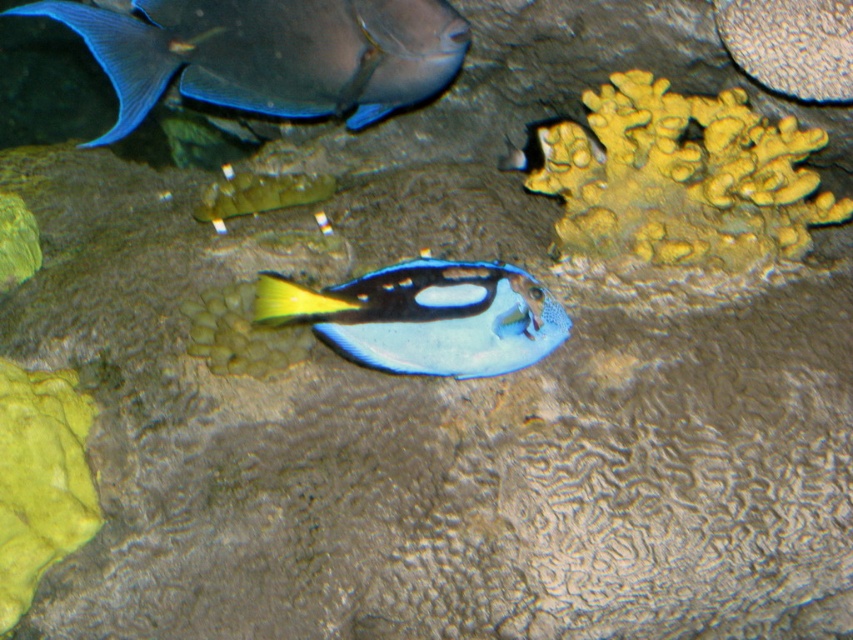
Which is more to the left, yellow porous coral at upper right or blue glossy fish at center?

From the viewer's perspective, blue glossy fish at center appears more on the left side.

Between point (785, 193) and point (482, 368), which one is positioned behind?

The point (785, 193) is more distant.

Measure the distance between yellow porous coral at upper right and camera.

yellow porous coral at upper right and camera are 5.98 feet apart from each other.

The height and width of the screenshot is (640, 853). In order to click on yellow porous coral at upper right in this screenshot , I will do `click(682, 179)`.

Looking at this image, is shiny blue fish at upper left to the left of blue glossy fish at center from the viewer's perspective?

Yes, shiny blue fish at upper left is to the left of blue glossy fish at center.

Is shiny blue fish at upper left further to the viewer compared to blue glossy fish at center?

Yes, it is behind blue glossy fish at center.

What do you see at coordinates (270, 52) in the screenshot?
I see `shiny blue fish at upper left` at bounding box center [270, 52].

Identify the location of shiny blue fish at upper left. (270, 52).

Does yellow porous coral at upper right have a greater width compared to shiny blue fish at upper left?

No.

Which is below, yellow porous coral at upper right or shiny blue fish at upper left?

yellow porous coral at upper right

This screenshot has width=853, height=640. Find the location of `yellow porous coral at upper right`. yellow porous coral at upper right is located at coordinates point(682,179).

Identify the location of yellow porous coral at upper right. The image size is (853, 640). (682, 179).